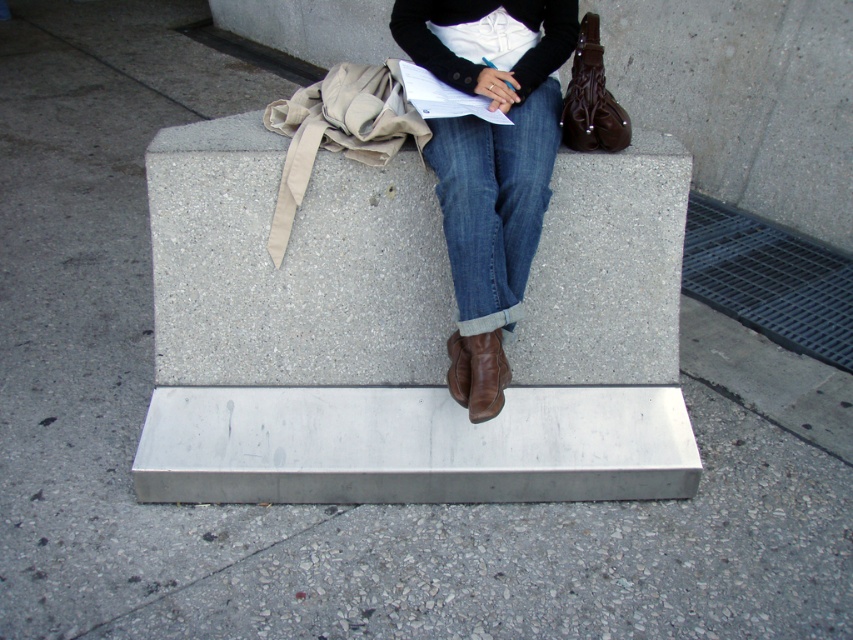
Question: Can you confirm if gray concrete bench at center is smaller than brown leather boot at center?

Choices:
 (A) no
 (B) yes

Answer: (A)

Question: Which of the following is the closest to the observer?

Choices:
 (A) (466, 378)
 (B) (614, 384)
 (C) (485, 307)

Answer: (C)

Question: Which is nearer to the denim/cuffed jeans at center?

Choices:
 (A) brown leather boot at center
 (B) gray concrete bench at center
 (C) denim jeans at center

Answer: (C)

Question: Does gray concrete bench at center appear over denim/cuffed jeans at center?

Choices:
 (A) yes
 (B) no

Answer: (B)

Question: Among these objects, which one is farthest from the camera?

Choices:
 (A) brown leather boot at center
 (B) gray concrete bench at center
 (C) denim/cuffed jeans at center
 (D) denim jeans at center

Answer: (B)

Question: Does denim jeans at center have a greater width compared to brown leather boot at center?

Choices:
 (A) yes
 (B) no

Answer: (A)